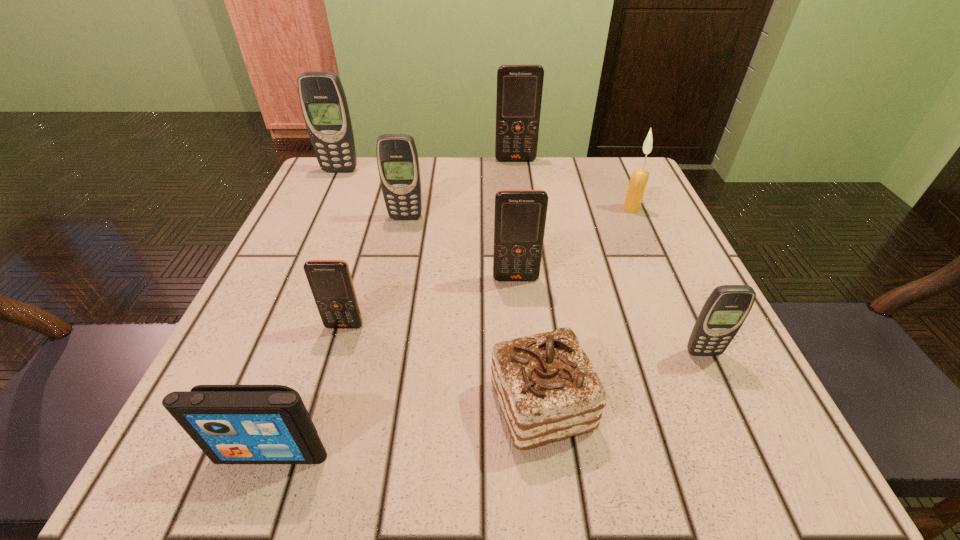
Locate an element on the screen. This screenshot has width=960, height=540. the smallest orange cellular telephone is located at coordinates (330, 281).

At what (x,y) coordinates should I click in order to perform the action: click on the fourth nearest object. Please return your answer as a coordinate pair (x, y). This screenshot has width=960, height=540. Looking at the image, I should click on (330, 281).

Locate an element on the screen. This screenshot has width=960, height=540. the nearest cellular telephone is located at coordinates (727, 307).

This screenshot has height=540, width=960. I want to click on the rightmost cellular telephone, so click(727, 307).

At what (x,y) coordinates should I click in order to perform the action: click on iPod. Please return your answer as a coordinate pair (x, y). Looking at the image, I should click on coord(232,424).

In order to click on the shortest object in this screenshot , I will do `click(547, 388)`.

What are the coordinates of `vacant space located 0.100m on the screen of the farthest cellular telephone` in the screenshot? It's located at (518, 184).

Locate an element on the screen. blank space located 0.160m on the screen of the second farthest object is located at coordinates (321, 212).

The image size is (960, 540). In order to click on vacant region located 0.190m on the screen of the fourth farthest object in this screenshot , I will do `click(392, 285)`.

Identify the location of free space located on the screen of the second farthest orange cellular telephone. [x=526, y=399].